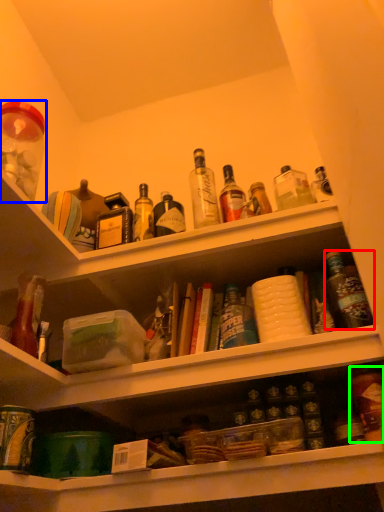
Question: Which object is positioned farthest from bottle (highlighted by a red box)? Select from beverage (highlighted by a blue box) and bottle (highlighted by a green box).

Choices:
 (A) beverage
 (B) bottle

Answer: (A)